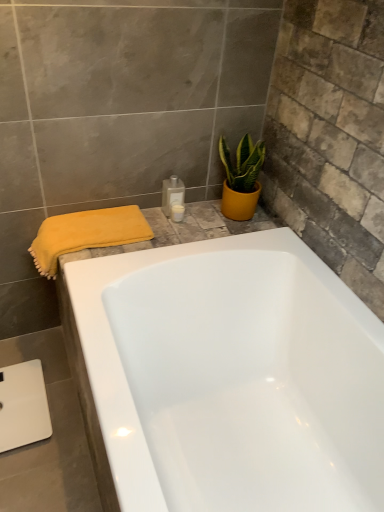
Question: Based on their sizes in the image, would you say translucent plastic bottle at upper center, the first toiletry from the top, is bigger or smaller than white glossy bottle at upper center, marked as the 1th toiletry in a bottom-to-top arrangement?

Choices:
 (A) big
 (B) small

Answer: (A)

Question: Choose the correct answer: Is translucent plastic bottle at upper center, which is counted as the second toiletry, starting from the bottom, inside white glossy bottle at upper center, acting as the 2th toiletry starting from the top, or outside it?

Choices:
 (A) inside
 (B) outside

Answer: (B)

Question: Which object is positioned farthest from the yellow matte pot at upper right?

Choices:
 (A) translucent plastic bottle at upper center, the first toiletry from the top
 (B) yellow soft towel at left
 (C) white glossy bottle at upper center, marked as the 1th toiletry in a bottom-to-top arrangement

Answer: (B)

Question: Which of these objects is positioned farthest from the yellow soft towel at left?

Choices:
 (A) white glossy bottle at upper center, acting as the 2th toiletry starting from the top
 (B) yellow matte pot at upper right
 (C) translucent plastic bottle at upper center, the first toiletry from the top

Answer: (B)